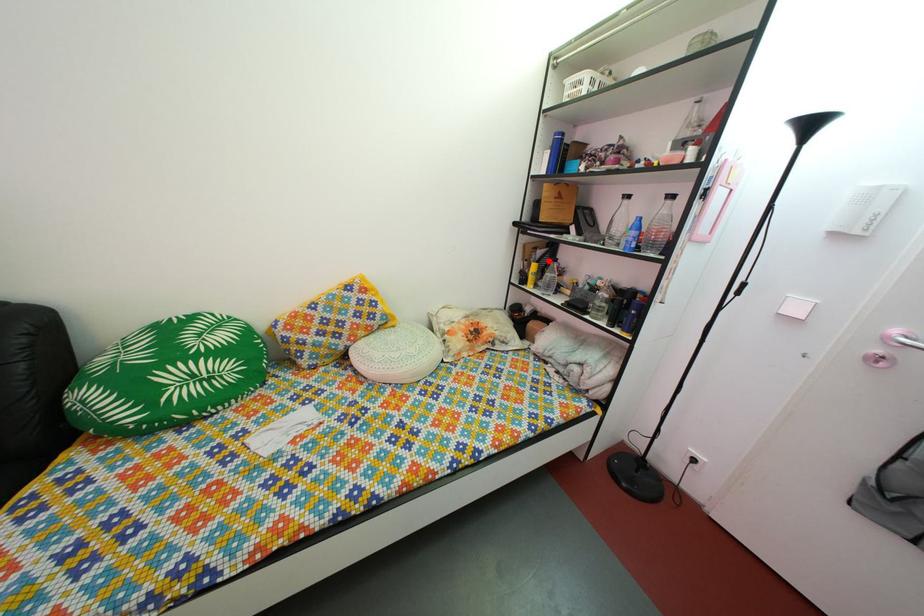
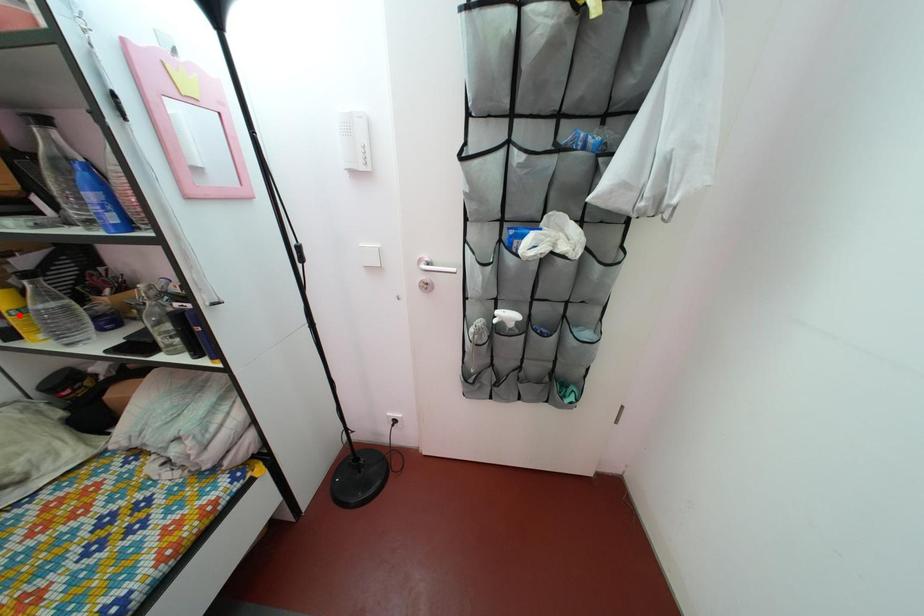
I am providing you with two images of the same scene from different viewpoints. A red point is marked on the first image and another point is marked on the second image. Does the point marked in image1 correspond to the same location as the one in image2?

No